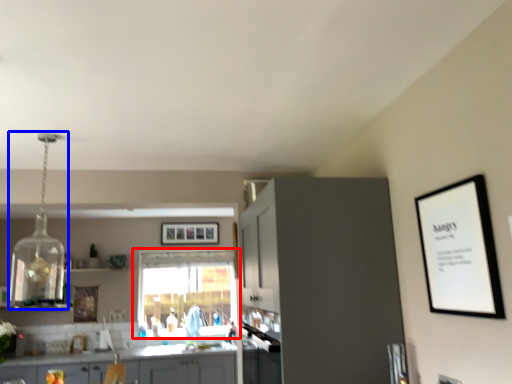
Question: Which of the following is the closest to the observer, window (highlighted by a red box) or light fixture (highlighted by a blue box)?

Choices:
 (A) window
 (B) light fixture

Answer: (B)